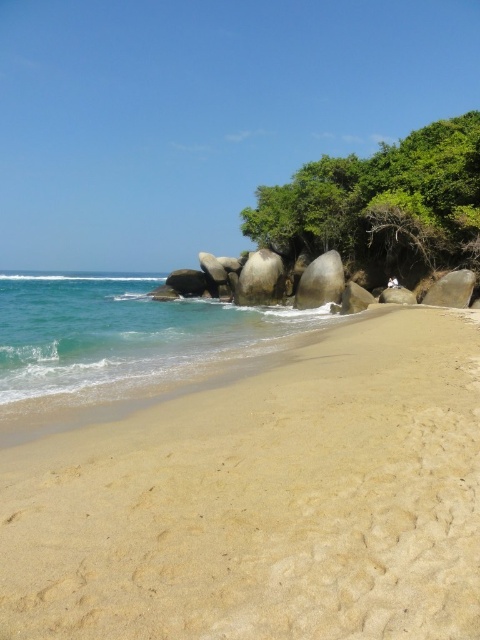
Can you confirm if smooth granite boulder at center is positioned above gray smooth rock at center-right?

Yes, smooth granite boulder at center is above gray smooth rock at center-right.

Is smooth granite boulder at center wider than gray smooth rock at center-right?

In fact, smooth granite boulder at center might be narrower than gray smooth rock at center-right.

Who is more forward, (239, 292) or (455, 305)?

Point (455, 305)

Where is `smooth granite boulder at center`? smooth granite boulder at center is located at coordinates (260, 280).

Which is more to the right, smooth granite boulder at center or smooth gray rock at center-right?

From the viewer's perspective, smooth gray rock at center-right appears more on the right side.

Is point (238, 278) positioned in front of point (398, 298)?

No, (238, 278) is behind (398, 298).

Is point (266, 259) less distant than point (412, 301)?

No.

Where is `smooth granite boulder at center`? This screenshot has height=640, width=480. smooth granite boulder at center is located at coordinates (260, 280).

Is smooth granite boulder at center above smooth gray rock at center?

Actually, smooth granite boulder at center is below smooth gray rock at center.

Is smooth granite boulder at center closer to the viewer compared to smooth gray rock at center?

No, it is behind smooth gray rock at center.

Measure the distance between point (244, 260) and camera.

Point (244, 260) and camera are 43.26 meters apart.

Where is `smooth granite boulder at center`? This screenshot has height=640, width=480. smooth granite boulder at center is located at coordinates (260, 280).